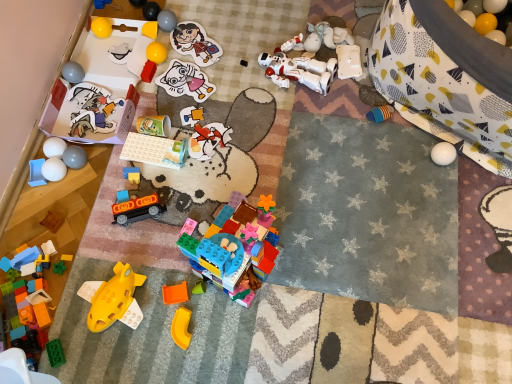
What are the coordinates of `free space that is in between matte paper sticker at upper center, which is counted as the twentieth toy, starting from the left, and translucent orange plastic toy at center, the fourth toy in the right-to-left sequence` in the screenshot? It's located at (197, 133).